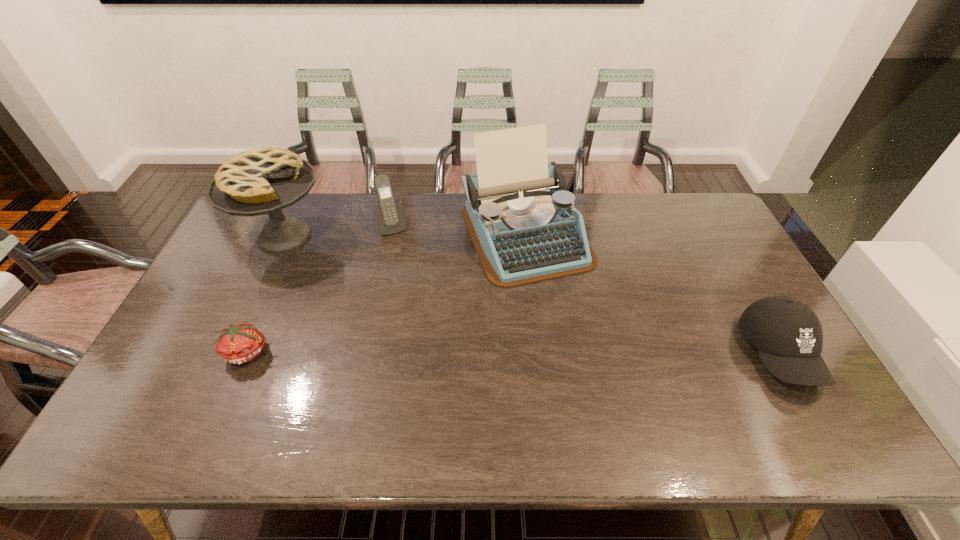
You are a GUI agent. You are given a task and a screenshot of the screen. Output one action in this format:
    pyautogui.click(x=<x>, y=<y>)
    Task: Click on the free spot on the desktop that is between the shortest object and the rightmost object and is positioned on the front-facing side of the cellular telephone
    
    Given the screenshot: What is the action you would take?
    pyautogui.click(x=446, y=352)

In order to click on free space on the desktop that is between the shortest object and the second shortest object and is positioned on the typing side of the fourth object from left to right in this screenshot , I will do `click(588, 353)`.

Find the location of `vacant spot on the desktop that is between the shortest object and the baseball cap and is positioned on the cut side of the pie`. vacant spot on the desktop that is between the shortest object and the baseball cap and is positioned on the cut side of the pie is located at coordinates (437, 352).